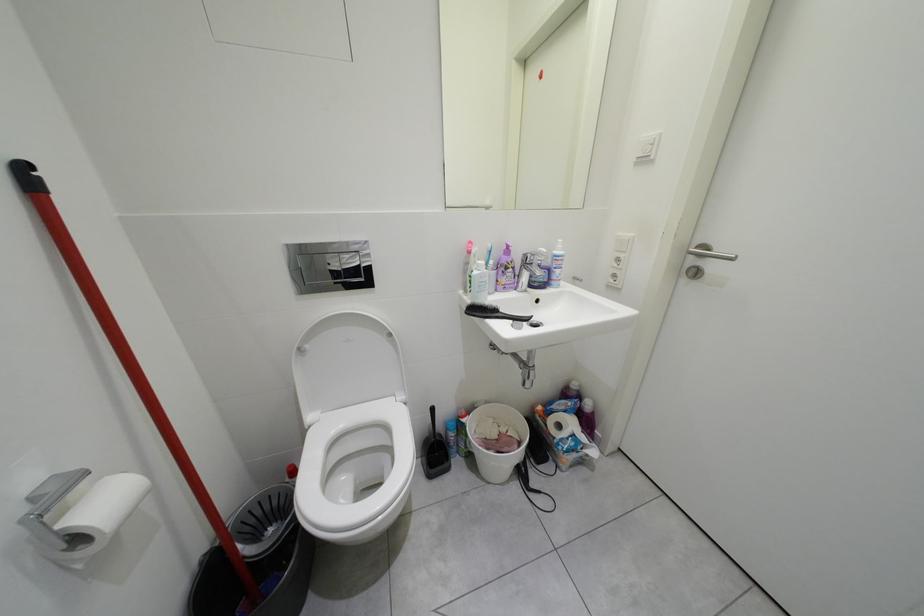
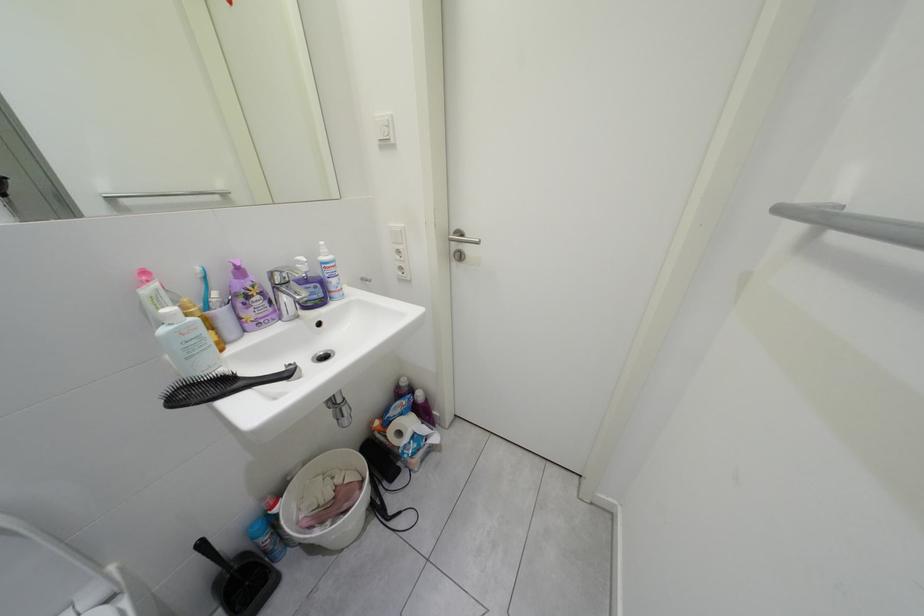
Question: The first image is from the beginning of the video and the second image is from the end. How did the camera likely rotate when shooting the video?

Choices:
 (A) Left
 (B) Right
 (C) Up
 (D) Down

Answer: (B)